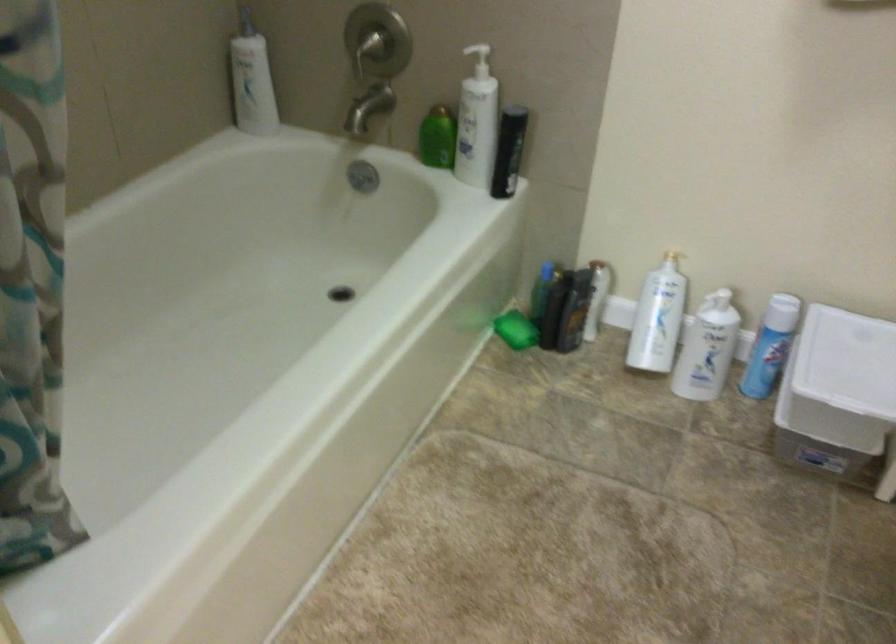
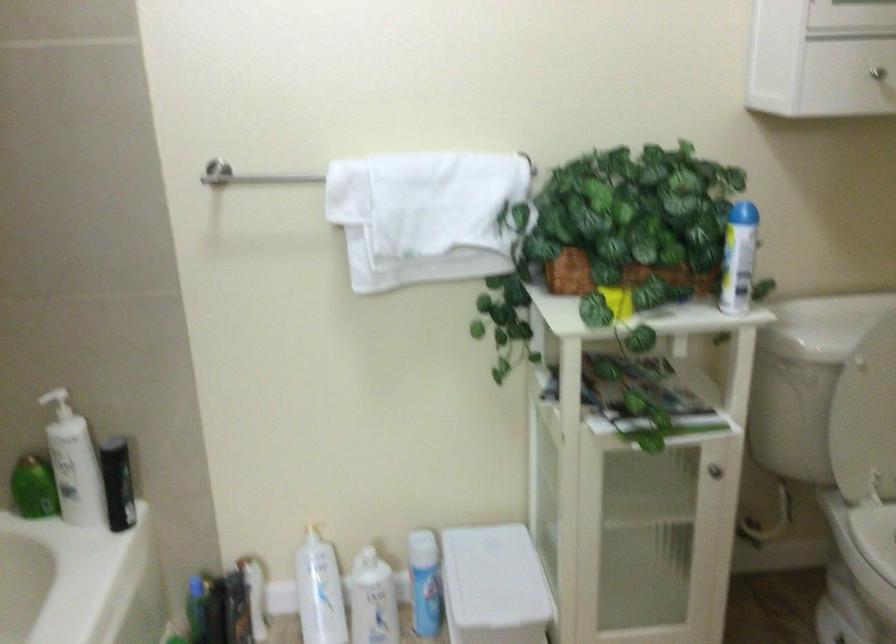
Where in the second image is the point corresponding to point 503,151 from the first image?

(117, 483)